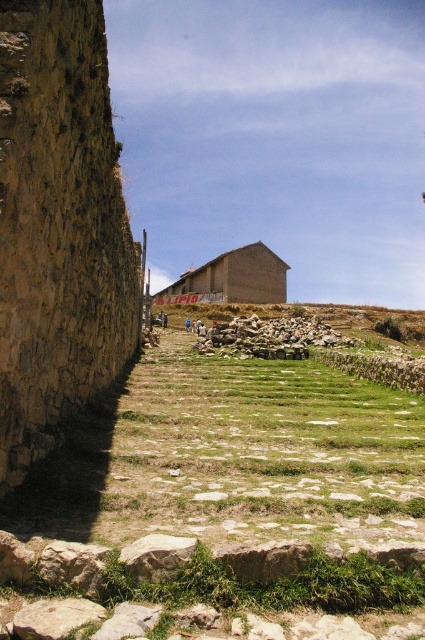
You are a landscape designer planning to place a new garden statue that is 2 meters tall. You want to ensure it doesn not block the view of the rustic stone wall at center from the brown rough rock at lower center. Can the statue be placed between them without blocking the view?

The rustic stone wall at center is taller than the brown rough rock at lower center. Since the statue is 2 meters tall, it could potentially block the view if placed between them. To ensure the view from the brown rough rock at lower center to the rustic stone wall at center remains unobstructed, the statue should be placed outside the line of sight between them or kept shorter than the brown rough rock at lower center.

You are standing in the middle of the grassy area and want to walk to the point labeled as point (220, 266) and point (166, 556). Which point will you reach first?

You will reach point (220, 266) first because it is closer to you than point (166, 556), which is further away.

You are standing at the center of the grassy area in the scene. You want to walk to the brown brick hut at center. Which direction should you go?

The brown brick hut at center is located at point (232, 278). Since you are at the center of the grassy area, which is likely the center of the image, you should move towards the direction of the brown brick hut at center. However, without specific coordinate reference, the exact direction cannot be determined precisely, but generally, the hut is positioned slightly to the upper right from the center.